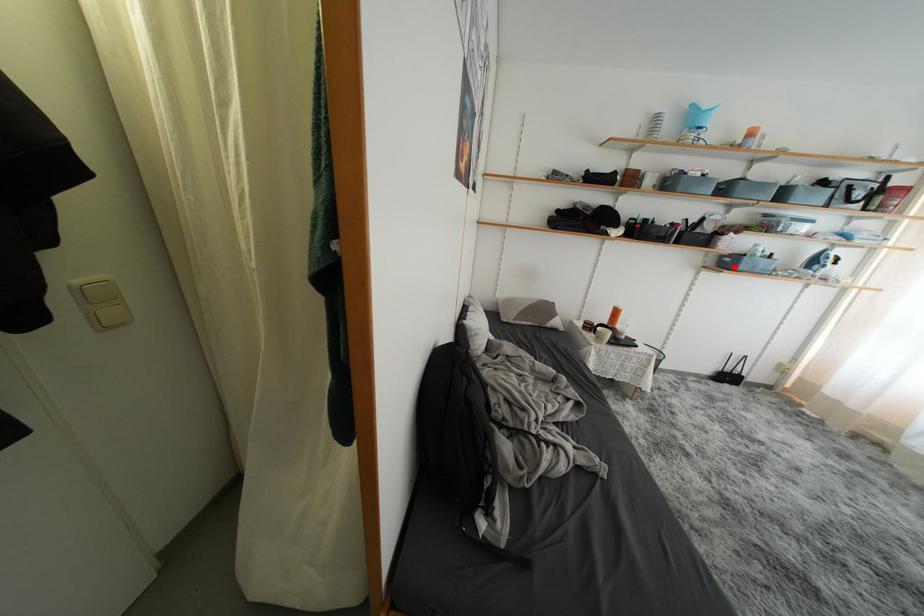
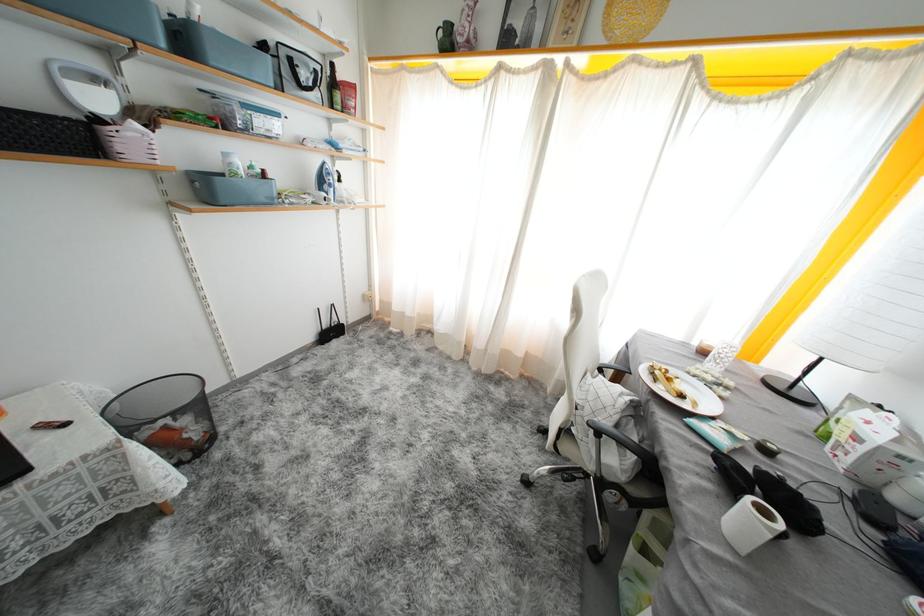
Locate, in the second image, the point that corresponds to the highlighted location in the first image.

(215, 196)